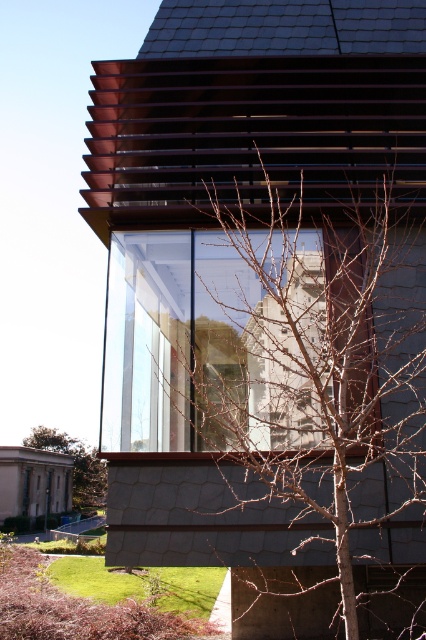
Question: Which object is positioned farthest from the brown leafless tree at lower left?

Choices:
 (A) bare branches at center
 (B) transparent glass window at center

Answer: (A)

Question: Does bare branches at center have a lesser width compared to transparent glass window at center?

Choices:
 (A) no
 (B) yes

Answer: (A)

Question: Estimate the real-world distances between objects in this image. Which object is farther from the transparent glass window at center?

Choices:
 (A) brown leafless tree at lower left
 (B) bare branches at center

Answer: (A)

Question: Does transparent glass window at center appear on the right side of brown leafless tree at lower left?

Choices:
 (A) no
 (B) yes

Answer: (B)

Question: Which object is positioned closest to the brown leafless tree at lower left?

Choices:
 (A) transparent glass window at center
 (B) bare branches at center

Answer: (A)

Question: Is bare branches at center thinner than brown leafless tree at lower left?

Choices:
 (A) no
 (B) yes

Answer: (B)